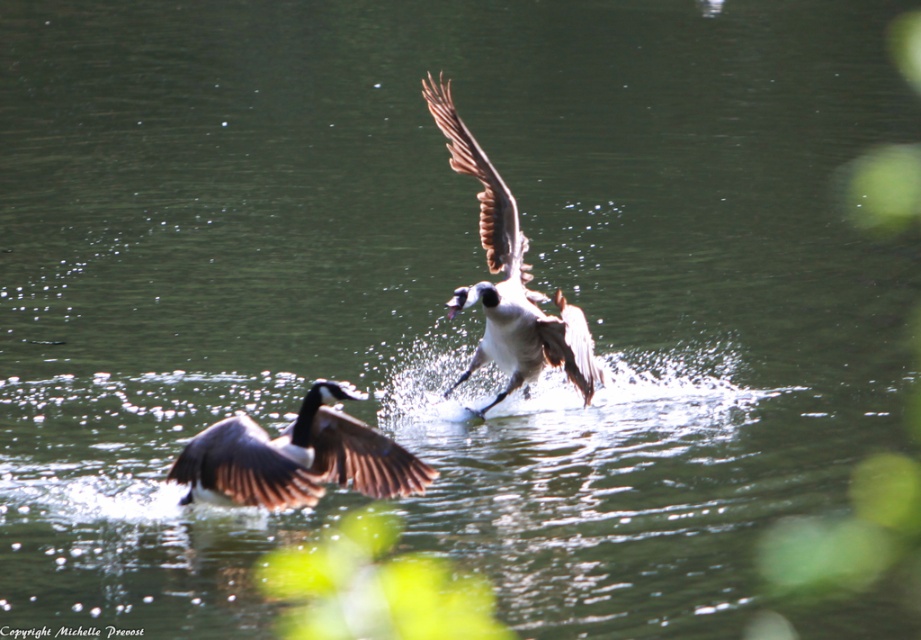
You are observing two geese taking off from a pond. You notice a brown feathered goose at center and a white feathered goose at center. Which goose is shorter in height?

The brown feathered goose at center is not as tall as the white feathered goose at center, so the brown feathered goose at center is shorter.

You are observing two Canada geese taking off from a pond. You notice a brown feathered goose at center and a brown feathered wing at upper center. Which object is positioned more to the right?

The brown feathered wing at upper center is positioned more to the right than the brown feathered goose at center.

You are a wildlife photographer trying to capture a photo of the white feathered goose at center and the brown feathered wing at upper center. Your camera has a zoom lens that can focus on objects within a 25 inch range. Can you capture both subjects in focus without moving the camera?

The white feathered goose at center is 26.79 inches from the brown feathered wing at upper center. Since the distance exceeds the 25 inch focus range, the camera cannot keep both in focus simultaneously. You would need to adjust the focus or move closer.